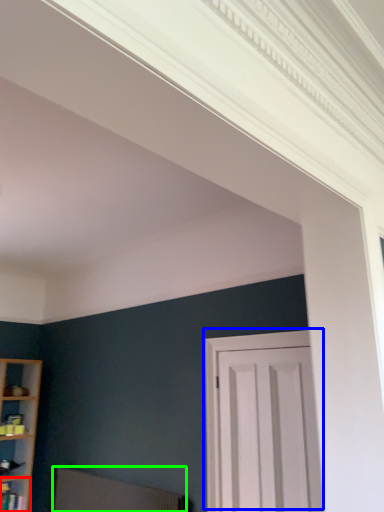
Question: Estimate the real-world distances between objects in this image. Which object is farther from shelf (highlighted by a red box), door (highlighted by a blue box) or swivel chair (highlighted by a green box)?

Choices:
 (A) door
 (B) swivel chair

Answer: (A)